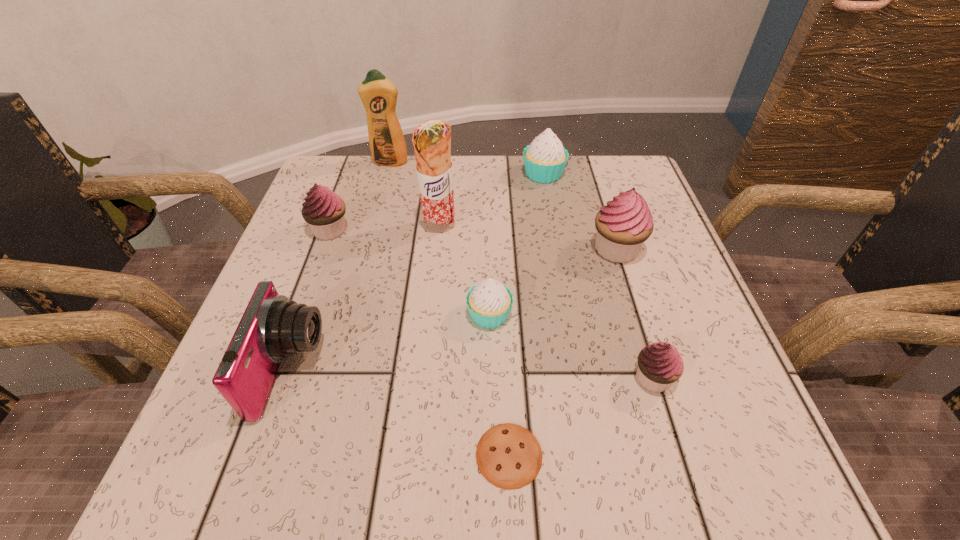
Locate an element on the screen. vacant space that is in between the detergent and the cookie is located at coordinates (449, 308).

Find the location of `vacant space that's between the nearest pink cupcake and the burrito`. vacant space that's between the nearest pink cupcake and the burrito is located at coordinates (546, 302).

Identify the location of unoccupied area between the seventh shortest object and the cookie. Image resolution: width=960 pixels, height=540 pixels. (563, 352).

I want to click on vacant space that's between the fourth object from left to right and the detergent, so click(x=415, y=194).

This screenshot has width=960, height=540. I want to click on empty space that is in between the nearest cupcake and the detergent, so click(521, 270).

At what (x,y) coordinates should I click in order to perform the action: click on free space between the nearest cupcake and the left white cupcake. Please return your answer as a coordinate pair (x, y). Looking at the image, I should click on (571, 346).

Where is `object identified as the fourth closest to the burrito`? object identified as the fourth closest to the burrito is located at coordinates (378, 94).

Locate an element on the screen. The width and height of the screenshot is (960, 540). object that is the seventh closest to the detergent is located at coordinates (509, 456).

At what (x,y) coordinates should I click in order to perform the action: click on cupcake that is the closest to the seventh object from left to right. Please return your answer as a coordinate pair (x, y). The image size is (960, 540). Looking at the image, I should click on (622, 226).

This screenshot has width=960, height=540. Find the location of `cupcake that stands as the second closest to the smallest pink cupcake`. cupcake that stands as the second closest to the smallest pink cupcake is located at coordinates (622, 226).